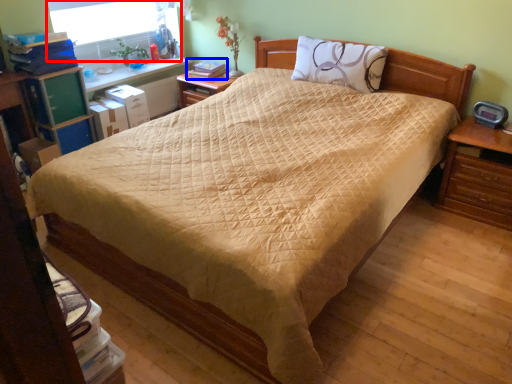
Question: Which point is further to the camera, window screen (highlighted by a red box) or book (highlighted by a blue box)?

Choices:
 (A) window screen
 (B) book

Answer: (B)